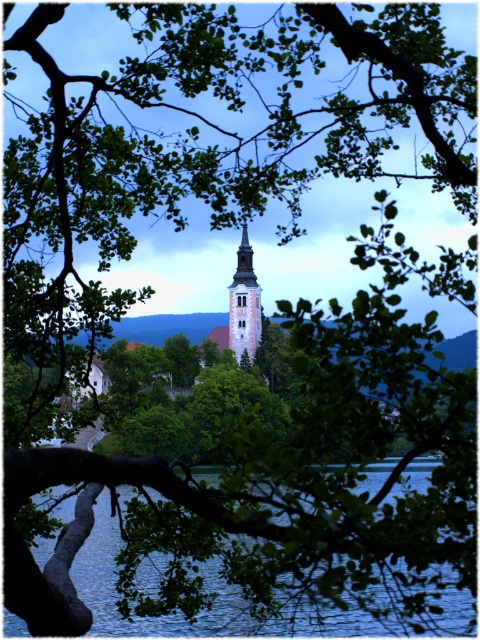
You are standing on the dock and want to reach the smooth glass spire at center. Which direction should you move to avoid the blue water at lower center?

To avoid the blue water at lower center, you should move upward from the dock towards the smooth glass spire at center since the blue water at lower center is located below it.

You are standing at the edge of the lake looking towards the church. You notice the blue water at lower center and the smooth glass spire at center. Which one of these two objects is wider from your perspective?

The blue water at lower center is wider than the smooth glass spire at center.